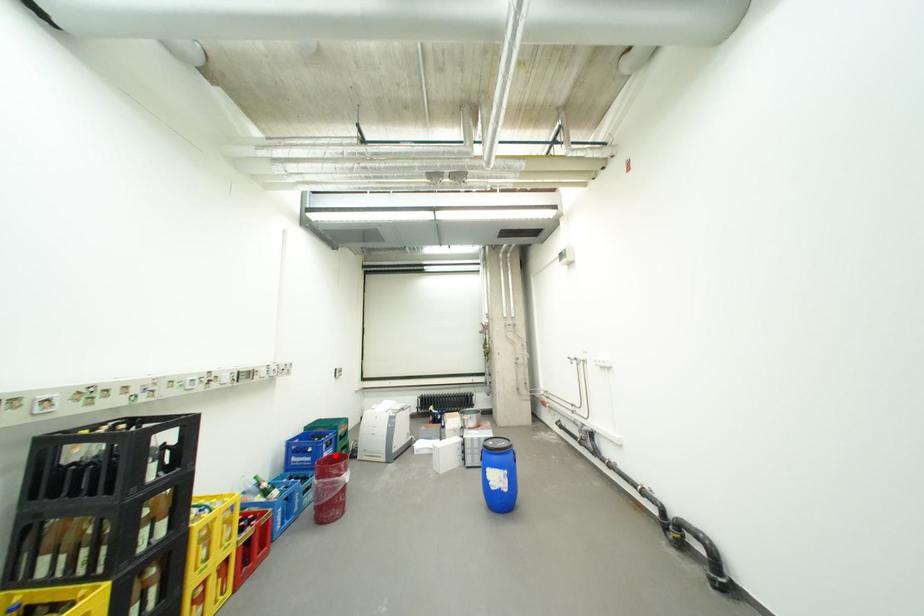
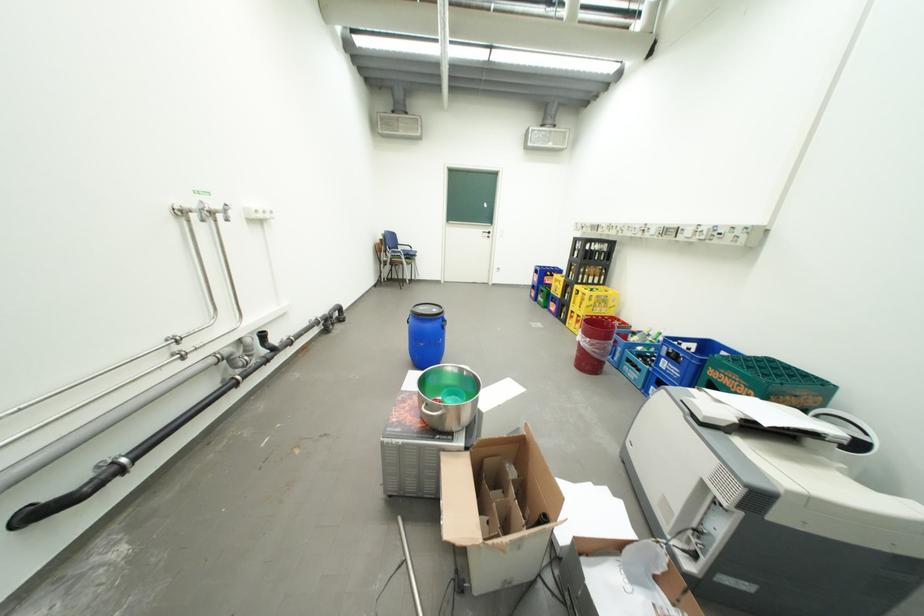
Question: A red point is marked in image1. In image2, is the corresponding 3D point closer to the camera or farther? Reply with the corresponding letter.

Choices:
 (A) The corresponding 3D point is closer.
 (B) The corresponding 3D point is farther.

Answer: (A)